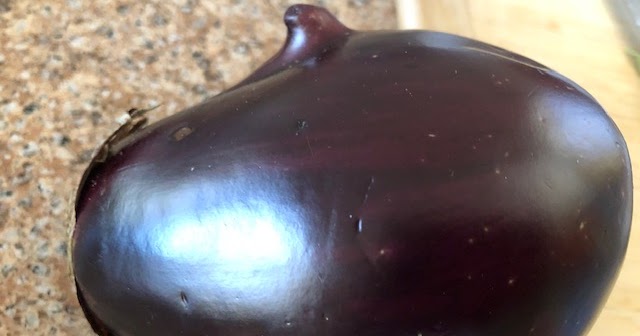
The image size is (640, 336). I want to click on light brown spots in counter top, so coord(187,70), coord(236,67), coord(269,32), coord(170,26), coord(77,75), coord(83,28), coord(61,153), coord(4,256), coord(32,310).